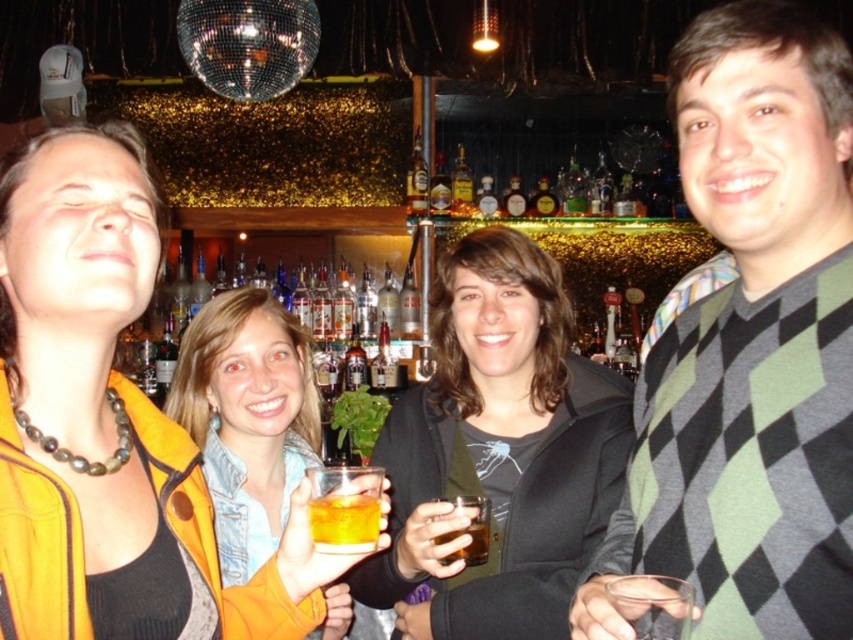
Who is more forward, (782, 310) or (357, 512)?

Point (357, 512) is in front.

Is argyle sweater at center to the left of amber liquid glass at center from the viewer's perspective?

In fact, argyle sweater at center is to the right of amber liquid glass at center.

You are a GUI agent. You are given a task and a screenshot of the screen. Output one action in this format:
    pyautogui.click(x=<x>, y=<y>)
    Task: Click on the argyle sweater at center
    This screenshot has width=853, height=640.
    Given the screenshot: What is the action you would take?
    pyautogui.click(x=750, y=346)

Is point (693, 134) behind point (3, 486)?

Yes, point (693, 134) is behind point (3, 486).

Is point (772, 109) closer to viewer compared to point (154, 275)?

No, (772, 109) is further to viewer.

Identify the location of argyle sweater at center. (750, 346).

Who is higher up, translucent glass at lower right or amber glass at center?

translucent glass at lower right is higher up.

Does translucent glass at lower right have a smaller size compared to amber glass at center?

Correct, translucent glass at lower right occupies less space than amber glass at center.

Who is more distant from viewer, (637, 592) or (476, 524)?

The point (476, 524) is behind.

The width and height of the screenshot is (853, 640). Identify the location of translucent glass at lower right. (653, 604).